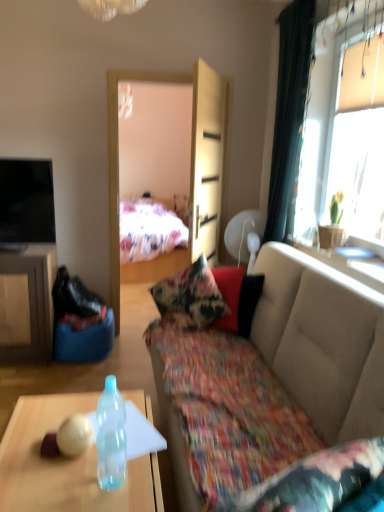
This screenshot has height=512, width=384. Identify the location of vacant area situated to the left side of transparent plastic bottle at lower left. (61, 484).